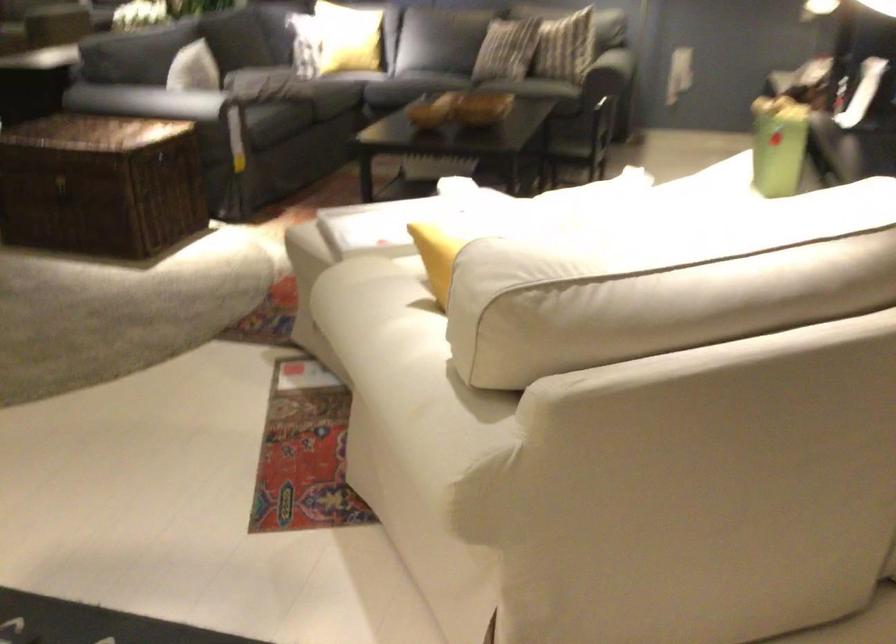
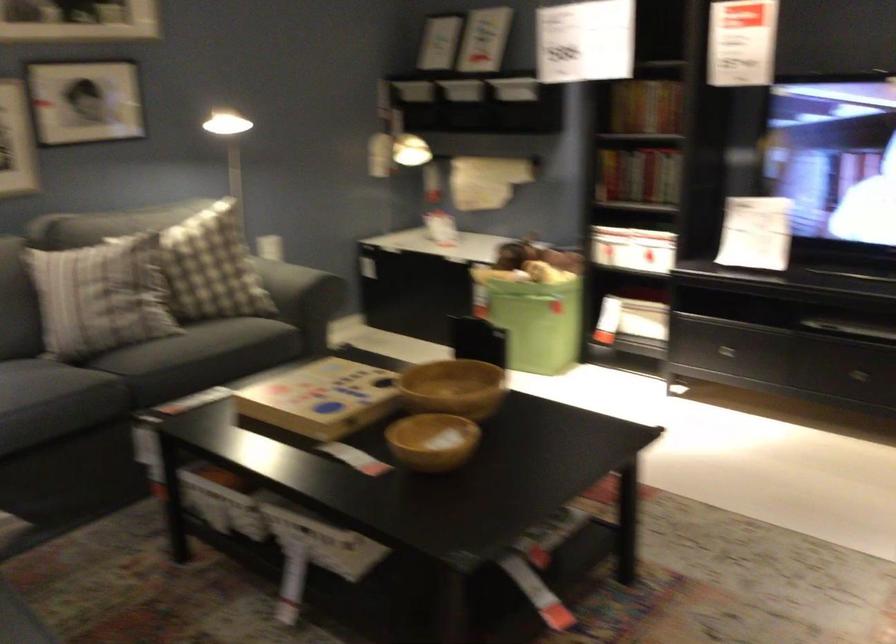
The point at (489, 77) is marked in the first image. Where is the corresponding point in the second image?

(199, 357)